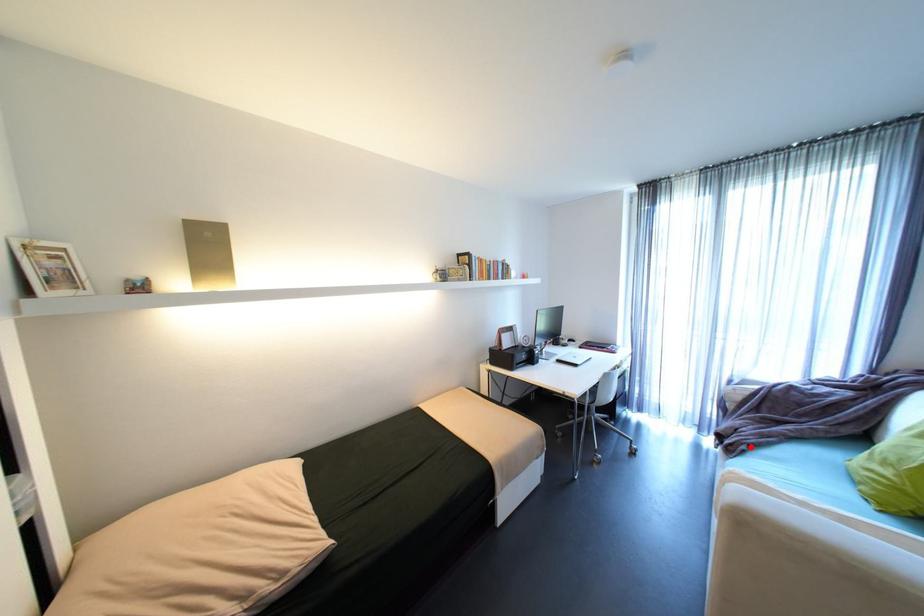
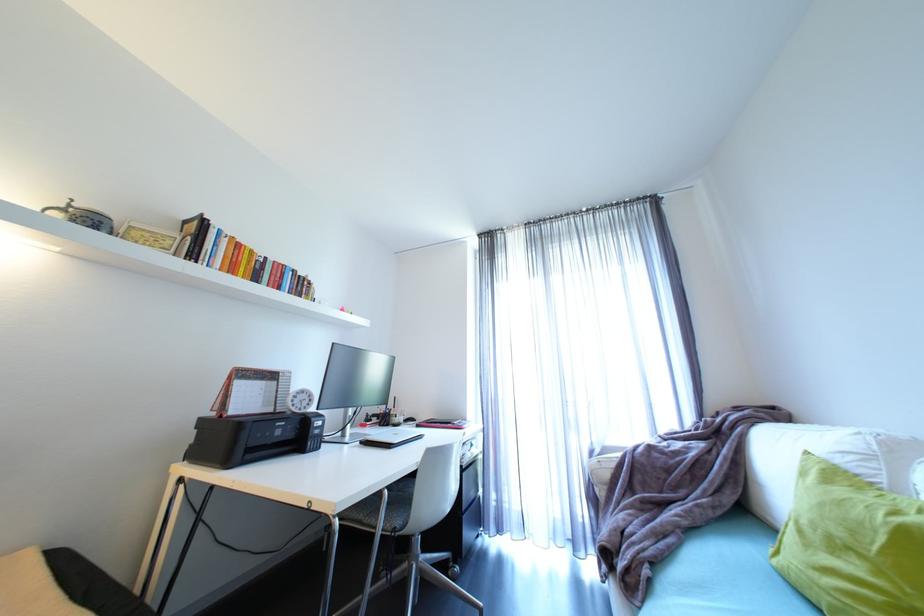
The point at the highlighted location is marked in the first image. Where is the corresponding point in the second image?

(653, 572)